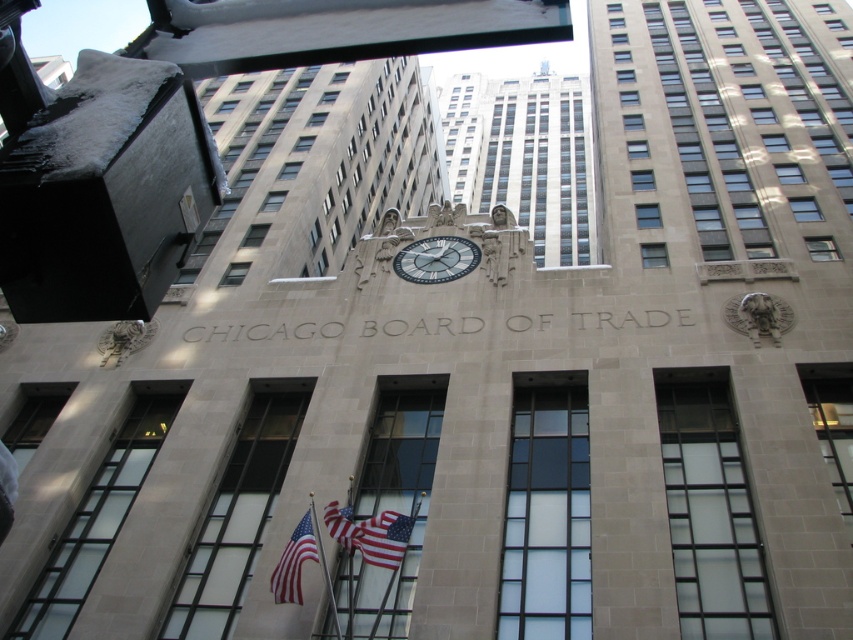
Is american flag at center smaller than metallic flagpole at center?

Incorrect, american flag at center is not smaller in size than metallic flagpole at center.

Is point (375, 536) closer to viewer compared to point (339, 628)?

No, it is behind (339, 628).

Who is more distant from viewer, (370, 557) or (312, 499)?

The point (312, 499) is more distant.

The width and height of the screenshot is (853, 640). I want to click on american flag at center, so click(x=370, y=532).

Between american flag at lower center and red fabric flag at center, which one has less height?

With less height is red fabric flag at center.

Between point (294, 545) and point (338, 515), which one is positioned in front?

Positioned in front is point (294, 545).

I want to click on american flag at lower center, so 294,561.

Between white glass clock at center and metallic flagpole at center, which one is positioned lower?

Positioned lower is metallic flagpole at center.

Is white glass clock at center bigger than metallic flagpole at center?

No.

What do you see at coordinates (436, 259) in the screenshot?
I see `white glass clock at center` at bounding box center [436, 259].

What are the coordinates of `white glass clock at center` in the screenshot? It's located at (436, 259).